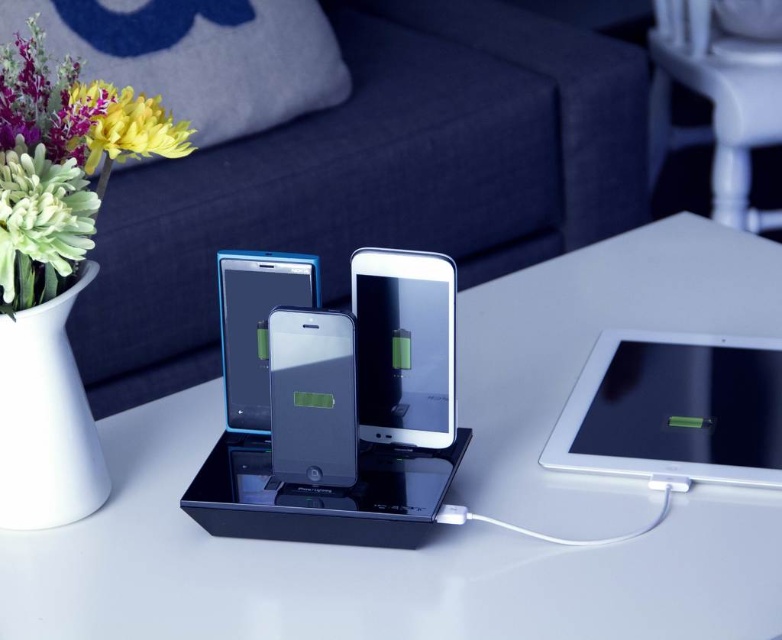
Question: Can you confirm if white glossy table at center is bigger than satin black phone at center?

Choices:
 (A) no
 (B) yes

Answer: (B)

Question: Which object is the closest to the satin black phone at center?

Choices:
 (A) white matte vase at upper left
 (B) silver metallic tablet at right
 (C) sleek silver ipod at center

Answer: (C)

Question: Can you confirm if white ceramic vase at left is positioned to the left of sleek silver ipod at center?

Choices:
 (A) yes
 (B) no

Answer: (A)

Question: Which point is farther to the camera?

Choices:
 (A) (368, 291)
 (B) (486, 294)

Answer: (B)

Question: Which object is farther from the camera taking this photo?

Choices:
 (A) satin black phone at center
 (B) sleek silver ipod at center
 (C) sleek glass ipod at center
 (D) green glossy flower at upper left

Answer: (A)

Question: Does silver metallic tablet at right have a lesser width compared to sleek glass ipod at center?

Choices:
 (A) yes
 (B) no

Answer: (B)